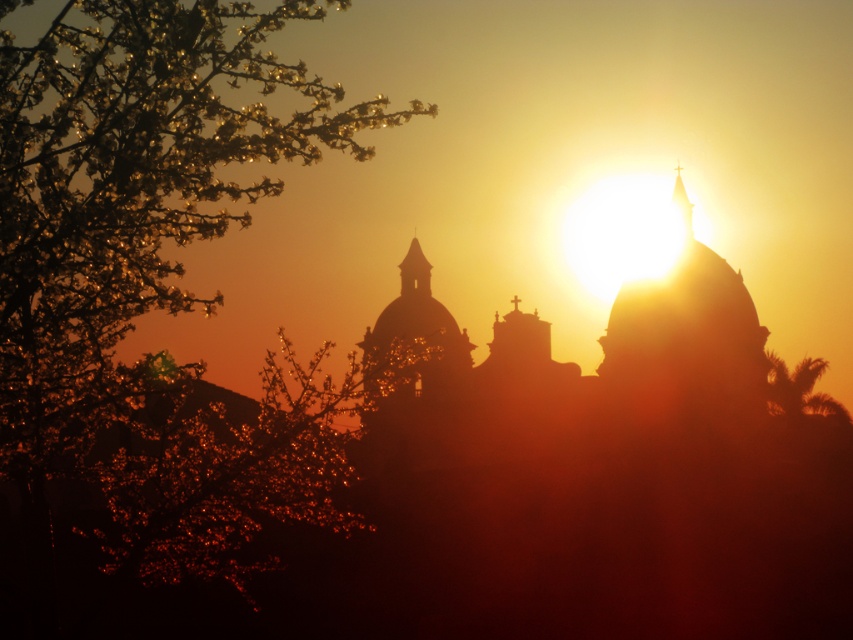
Question: Which of the following is the closest to the observer?

Choices:
 (A) (785, 385)
 (B) (683, 230)
 (C) (402, 276)

Answer: (A)

Question: Is green leafy palm at right below matte gold spire at center?

Choices:
 (A) no
 (B) yes

Answer: (B)

Question: Is matte gold spire at center to the left of transparent glass spire at upper center from the viewer's perspective?

Choices:
 (A) yes
 (B) no

Answer: (A)

Question: Among these points, which one is nearest to the camera?

Choices:
 (A) (418, 284)
 (B) (691, 225)

Answer: (B)

Question: Which point appears farthest from the camera in this image?

Choices:
 (A) (685, 196)
 (B) (422, 272)
 (C) (781, 410)

Answer: (B)

Question: Is green leafy palm at right positioned before transparent glass spire at upper center?

Choices:
 (A) no
 (B) yes

Answer: (B)